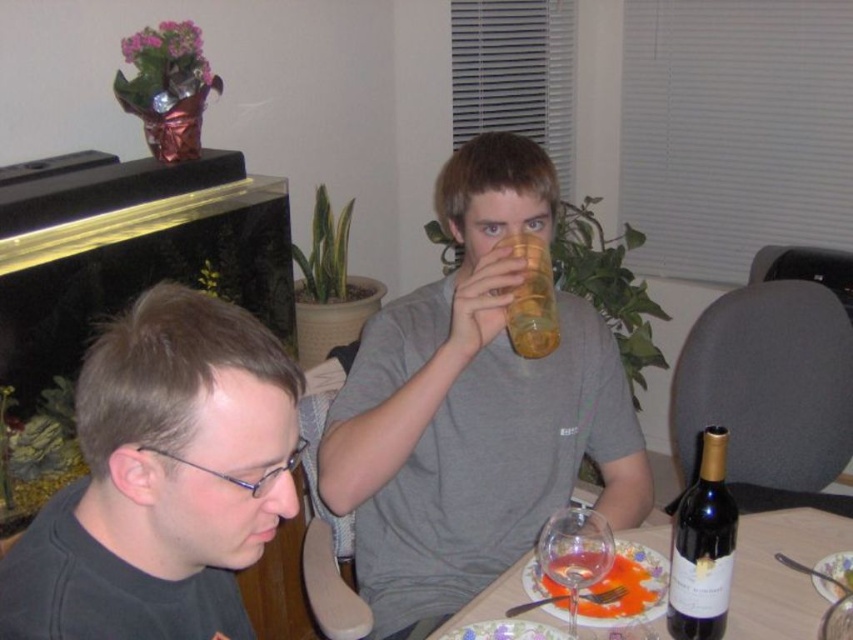
Question: Estimate the real-world distances between objects in this image. Which object is closer to the translucent plastic cup at upper center?

Choices:
 (A) dark glass wine bottle at lower right
 (B) matte yellow cup at center
 (C) translucent glass wine at lower center

Answer: (B)

Question: In this image, where is matte yellow cup at center located relative to translucent glass wine glass at lower center?

Choices:
 (A) above
 (B) below

Answer: (A)

Question: Can you confirm if translucent glass wine at lower center is positioned above transparent glass wine glass at lower center?

Choices:
 (A) yes
 (B) no

Answer: (B)

Question: Does translucent glass wine glass at lower center have a lesser width compared to dark glass wine bottle at lower right?

Choices:
 (A) yes
 (B) no

Answer: (B)

Question: Estimate the real-world distances between objects in this image. Which object is closer to the translucent glass wine at lower center?

Choices:
 (A) dark glass wine bottle at lower right
 (B) black matte glasses at center
 (C) matte yellow cup at center
 (D) transparent glass wine glass at lower center

Answer: (D)

Question: Among these objects, which one is farthest from the camera?

Choices:
 (A) transparent glass wine glass at lower center
 (B) black matte glasses at center

Answer: (A)